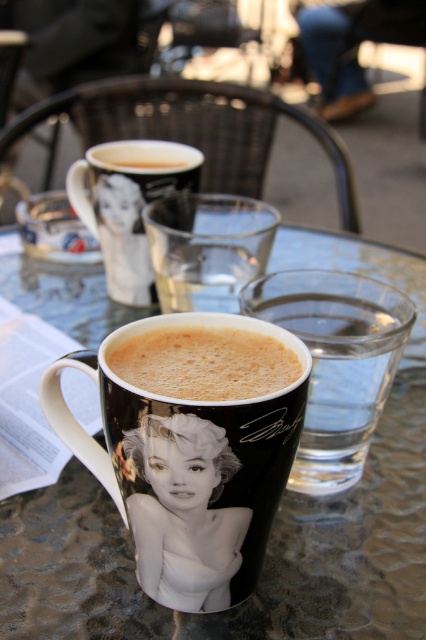
Question: Which point appears farthest from the camera in this image?

Choices:
 (A) (316, 513)
 (B) (158, 168)
 (C) (98, 227)
 (D) (363, 292)

Answer: (B)

Question: Can you confirm if transparent glass table at center is thinner than transparent glass at center?

Choices:
 (A) no
 (B) yes

Answer: (A)

Question: Which object is farther from the camera taking this photo?

Choices:
 (A) black glossy mug at center
 (B) transparent glass at center

Answer: (B)

Question: Which point is closer to the camera taking this photo?

Choices:
 (A) (270, 369)
 (B) (193, 180)
 (C) (360, 460)
 (D) (334, 522)

Answer: (A)

Question: Is matte black coffee cup at center positioned before foamy brown coffee at center?

Choices:
 (A) no
 (B) yes

Answer: (A)

Question: Does transparent glass table at center appear on the right side of matte black coffee cup at center?

Choices:
 (A) yes
 (B) no

Answer: (B)